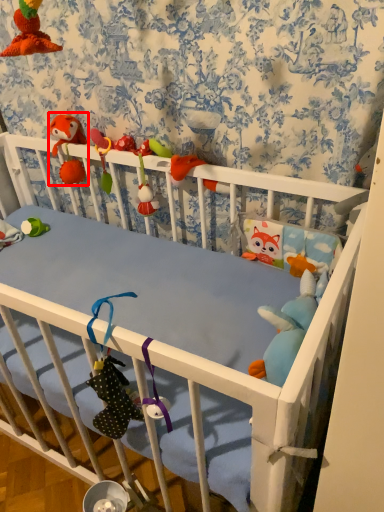
Question: Where is toy (annotated by the red box) located in relation to toy in the image?

Choices:
 (A) right
 (B) left

Answer: (B)